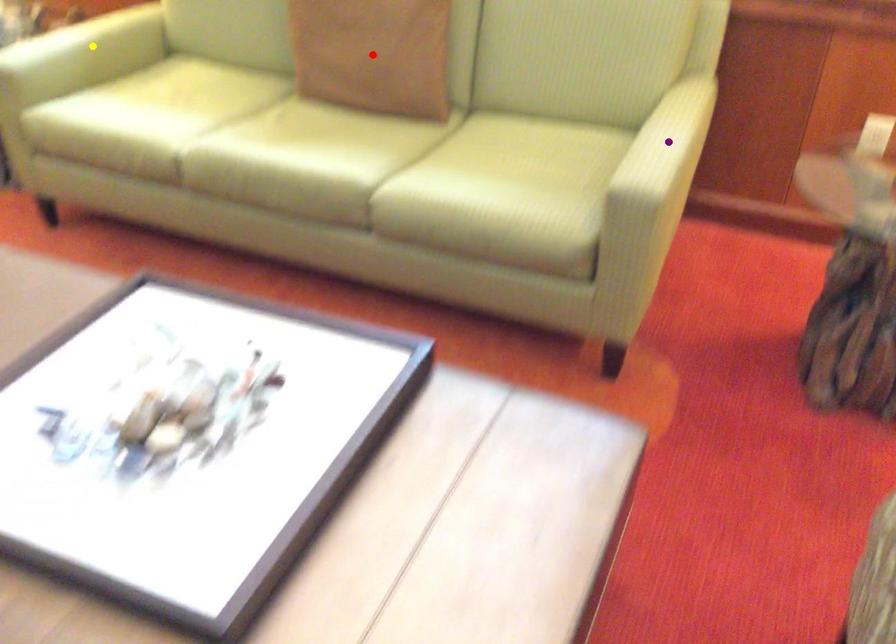
Order these from nearest to farthest:
1. purple point
2. red point
3. yellow point

purple point, red point, yellow point